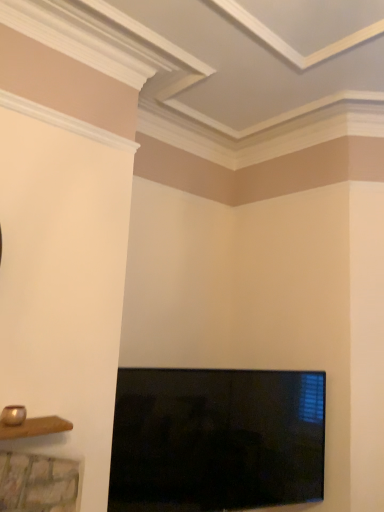
Question: Should I look upward or downward to see flat-screen tv at lower center?

Choices:
 (A) down
 (B) up

Answer: (A)